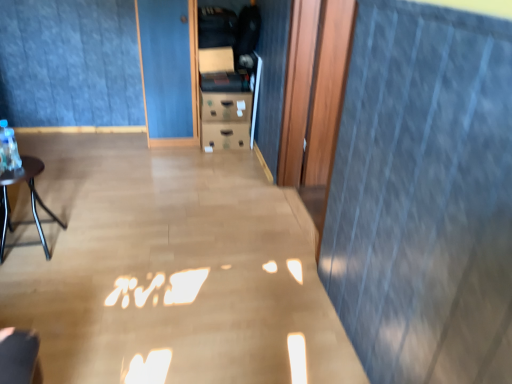
Describe the element at coordinates (31, 200) in the screenshot. The height and width of the screenshot is (384, 512). I see `matte black table at left` at that location.

Identify the location of matte black table at left. The height and width of the screenshot is (384, 512). (31, 200).

Image resolution: width=512 pixels, height=384 pixels. What do you see at coordinates (69, 63) in the screenshot?
I see `blue fabric curtain at upper center` at bounding box center [69, 63].

In order to face blue fabric curtain at upper center, should I rotate leftwards or rightwards?

Rotate your view left by about 17.119°.

Where is `blue fabric curtain at upper center`? The height and width of the screenshot is (384, 512). blue fabric curtain at upper center is located at coordinates (69, 63).

Locate an element on the screen. The width and height of the screenshot is (512, 384). matte black table at left is located at coordinates (31, 200).

Based on their positions, is matte black table at left located to the left or right of blue fabric curtain at upper center?

Based on their positions, matte black table at left is located to the left of blue fabric curtain at upper center.

Considering the relative positions of matte black table at left and blue fabric curtain at upper center in the image provided, is matte black table at left in front of blue fabric curtain at upper center?

Yes, matte black table at left is closer to the camera.

Is point (1, 189) positioned after point (65, 39)?

That is False.

Based on the photo, from the image's perspective, is matte black table at left located beneath blue fabric curtain at upper center?

Yes.

From a real-world perspective, is matte black table at left under blue fabric curtain at upper center?

Correct, in the physical world, matte black table at left is lower than blue fabric curtain at upper center.

From the picture: Considering the sizes of objects matte black table at left and blue fabric curtain at upper center in the image provided, who is wider, matte black table at left or blue fabric curtain at upper center?

With larger width is matte black table at left.

Considering the sizes of objects matte black table at left and blue fabric curtain at upper center in the image provided, who is taller, matte black table at left or blue fabric curtain at upper center?

Standing taller between the two is blue fabric curtain at upper center.

In terms of size, does matte black table at left appear bigger or smaller than blue fabric curtain at upper center?

Clearly, matte black table at left is smaller in size than blue fabric curtain at upper center.

Looking at this image, is blue fabric curtain at upper center completely or partially inside matte black table at left?

No, blue fabric curtain at upper center is located outside of matte black table at left.

Is matte black table at left placed right next to blue fabric curtain at upper center?

No, matte black table at left is not with blue fabric curtain at upper center.

Could you tell me if matte black table at left is turned towards blue fabric curtain at upper center?

No, matte black table at left is not oriented towards blue fabric curtain at upper center.

Measure the distance between matte black table at left and blue fabric curtain at upper center.

4.19 feet.

Identify the location of furniture below the blue fabric curtain at upper center (from a real-world perspective). This screenshot has width=512, height=384. (31, 200).

Is blue fabric curtain at upper center at the left side of matte black table at left?

In fact, blue fabric curtain at upper center is to the right of matte black table at left.

Which object is further away from the camera taking this photo, blue fabric curtain at upper center or matte black table at left?

blue fabric curtain at upper center is more distant.

Which is in front, point (98, 52) or point (12, 172)?

The point (12, 172) is closer.

From the image's perspective, is blue fabric curtain at upper center above or below matte black table at left?

Clearly, from the image's perspective, blue fabric curtain at upper center is above matte black table at left.

From a real-world perspective, is blue fabric curtain at upper center located higher than matte black table at left?

Yes, from a real-world perspective, blue fabric curtain at upper center is on top of matte black table at left.

Looking at their sizes, would you say blue fabric curtain at upper center is wider or thinner than matte black table at left?

In the image, blue fabric curtain at upper center appears to be more narrow than matte black table at left.

Does blue fabric curtain at upper center have a lesser height compared to matte black table at left?

Incorrect, the height of blue fabric curtain at upper center does not fall short of that of matte black table at left.

Considering the sizes of objects blue fabric curtain at upper center and matte black table at left in the image provided, who is smaller, blue fabric curtain at upper center or matte black table at left?

matte black table at left is smaller.

Which is correct: blue fabric curtain at upper center is inside matte black table at left, or outside of it?

blue fabric curtain at upper center is located beyond the bounds of matte black table at left.

Are blue fabric curtain at upper center and matte black table at left beside each other?

There is a gap between blue fabric curtain at upper center and matte black table at left.

Is blue fabric curtain at upper center positioned with its back to matte black table at left?

No, matte black table at left is not at the back of blue fabric curtain at upper center.

The width and height of the screenshot is (512, 384). I want to click on curtain that appears above the matte black table at left (from the image's perspective), so [69, 63].

This screenshot has width=512, height=384. Identify the location of furniture located in front of the blue fabric curtain at upper center. (31, 200).

At what (x,y) coordinates should I click in order to perform the action: click on furniture that is under the blue fabric curtain at upper center (from a real-world perspective). Please return your answer as a coordinate pair (x, y). Looking at the image, I should click on (31, 200).